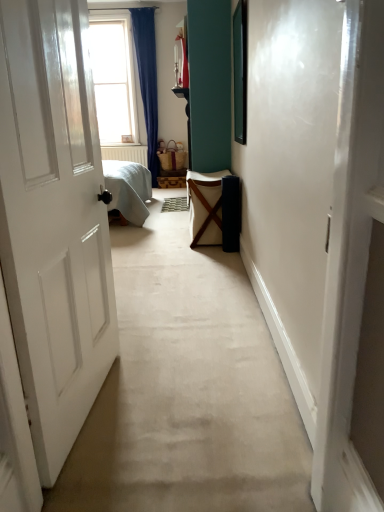
Question: Does textured beige doormat at center have a greater width compared to white canvas laundry basket at center?

Choices:
 (A) yes
 (B) no

Answer: (B)

Question: From the image's perspective, is textured beige doormat at center below white canvas laundry basket at center?

Choices:
 (A) yes
 (B) no

Answer: (B)

Question: From a real-world perspective, does textured beige doormat at center stand above white canvas laundry basket at center?

Choices:
 (A) no
 (B) yes

Answer: (A)

Question: Is textured beige doormat at center in contact with white canvas laundry basket at center?

Choices:
 (A) no
 (B) yes

Answer: (A)

Question: Can you confirm if textured beige doormat at center is thinner than white canvas laundry basket at center?

Choices:
 (A) yes
 (B) no

Answer: (A)

Question: Would you say white canvas laundry basket at center is to the left or to the right of textured beige doormat at center in the picture?

Choices:
 (A) right
 (B) left

Answer: (A)

Question: Based on their sizes in the image, would you say white canvas laundry basket at center is bigger or smaller than textured beige doormat at center?

Choices:
 (A) small
 (B) big

Answer: (B)

Question: In the image, is white canvas laundry basket at center positioned in front of or behind textured beige doormat at center?

Choices:
 (A) behind
 (B) front

Answer: (B)

Question: Considering the positions of point (195, 181) and point (178, 208), is point (195, 181) closer or farther from the camera than point (178, 208)?

Choices:
 (A) farther
 (B) closer

Answer: (B)

Question: From a real-world perspective, is textured beige doormat at center positioned above or below white canvas laundry basket at center?

Choices:
 (A) above
 (B) below

Answer: (B)

Question: Is textured beige doormat at center wider or thinner than white canvas laundry basket at center?

Choices:
 (A) wide
 (B) thin

Answer: (B)

Question: Considering the relative positions of textured beige doormat at center and white canvas laundry basket at center in the image provided, is textured beige doormat at center to the left or to the right of white canvas laundry basket at center?

Choices:
 (A) right
 (B) left

Answer: (B)

Question: Considering their positions, is textured beige doormat at center located in front of or behind white canvas laundry basket at center?

Choices:
 (A) behind
 (B) front

Answer: (A)

Question: Based on their sizes in the image, would you say clear glass window at upper left is bigger or smaller than textured beige doormat at center?

Choices:
 (A) small
 (B) big

Answer: (B)

Question: From their relative heights in the image, would you say clear glass window at upper left is taller or shorter than textured beige doormat at center?

Choices:
 (A) tall
 (B) short

Answer: (A)